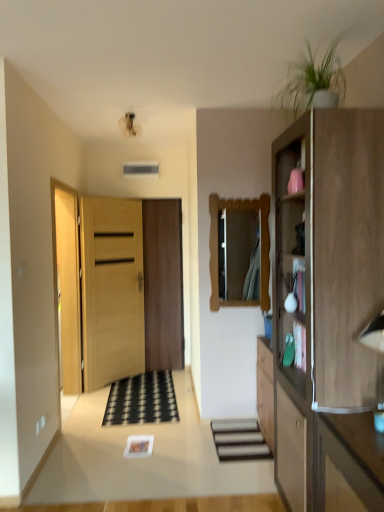
Identify the location of blank space above smooth wooden stairs at center (from a real-world perspective). (241, 440).